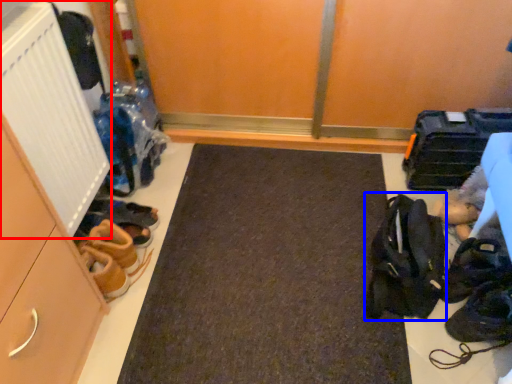
Question: Among these objects, which one is farthest to the camera, radiator (highlighted by a red box) or accessory (highlighted by a blue box)?

Choices:
 (A) radiator
 (B) accessory

Answer: (B)